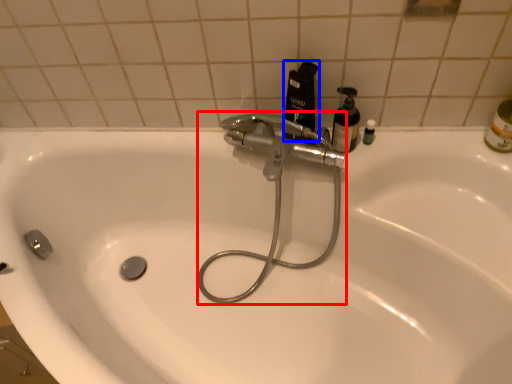
Question: Which of the following is the closest to the observer, plumbing fixture (highlighted by a red box) or cleaning product (highlighted by a blue box)?

Choices:
 (A) plumbing fixture
 (B) cleaning product

Answer: (A)